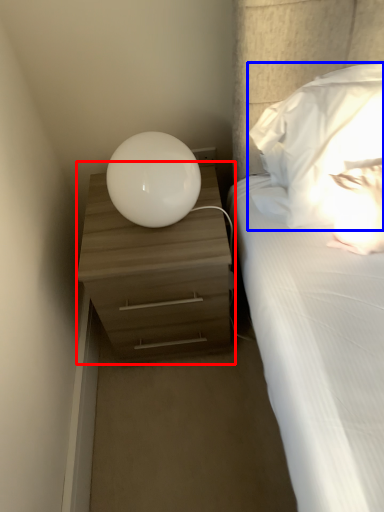
Question: Which point is further to the camera, nightstand (highlighted by a red box) or pillow (highlighted by a blue box)?

Choices:
 (A) nightstand
 (B) pillow

Answer: (A)